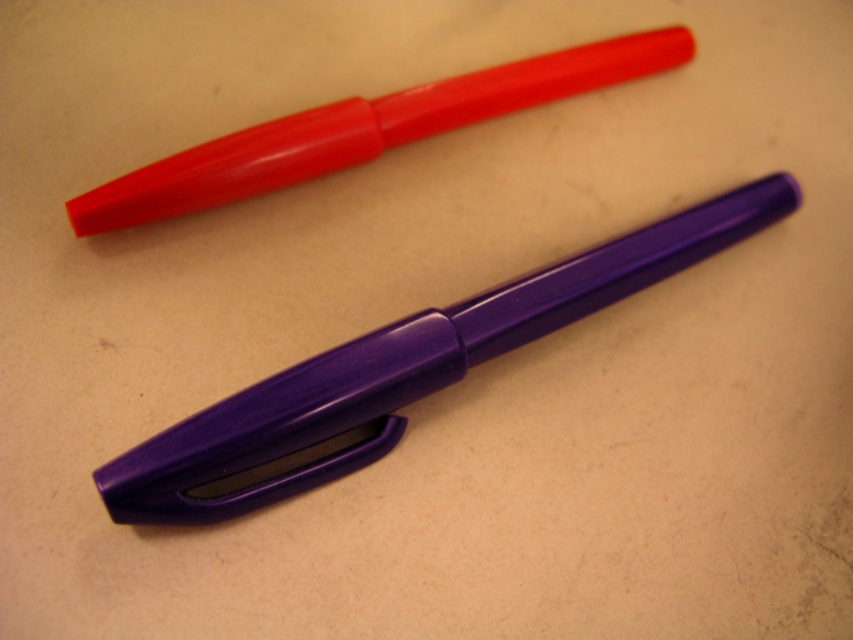
Question: Which point is farther to the camera?

Choices:
 (A) matte plastic pen at upper center
 (B) glossy purple fountain pen at center

Answer: (A)

Question: Is glossy purple fountain pen at center further to camera compared to matte plastic pen at upper center?

Choices:
 (A) no
 (B) yes

Answer: (A)

Question: Is glossy purple fountain pen at center to the right of matte plastic pen at upper center from the viewer's perspective?

Choices:
 (A) yes
 (B) no

Answer: (A)

Question: Does glossy purple fountain pen at center have a larger size compared to matte plastic pen at upper center?

Choices:
 (A) no
 (B) yes

Answer: (B)

Question: Which object appears closest to the camera in this image?

Choices:
 (A) matte plastic pen at upper center
 (B) glossy purple fountain pen at center

Answer: (B)

Question: Which point is farther to the camera?

Choices:
 (A) (368, 444)
 (B) (440, 116)

Answer: (B)